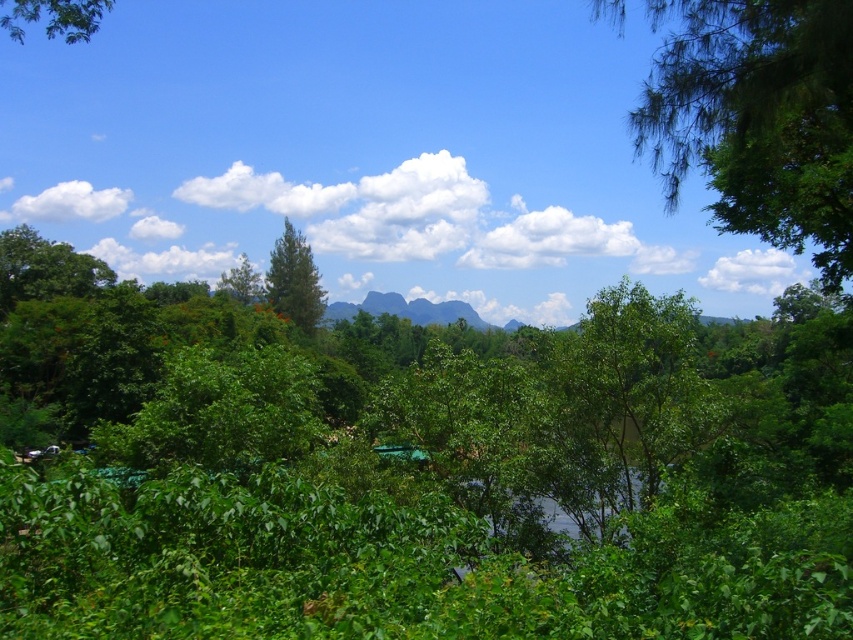
You are a hiker planning to walk from the green leafy tree at upper left to the green rock formation at center. Given that your average walking pace is 1.5 meters per second, how many seconds will it take you to reach the rock formation?

The distance between the green leafy tree at upper left and the green rock formation at center is 103.28 meters. At a pace of 1.5 meters per second, it would take approximately 68.85 seconds to reach the rock formation.

You are an environmental scientist analyzing the spatial distribution of vegetation in the image. Given that the coordinate system starts at the bottom left corner of the image with x increasing to the right and y increasing upwards, can you confirm if the green leafy tree at upper left is located in the top 10 percent of the image vertically?

The green leafy tree at upper left is located at point y coordinate 0.064. Since the coordinate system starts at the bottom left with y increasing upwards, the top 10 percent would be y values between 0.9 and 1.0. The tree is at 0.064, which is much lower than 0.9, so it is not in the top 10 percent vertically.

You are an explorer navigating through this lush landscape. You need to locate the green rock formation at center. Which direction should you move from the green leafy tree at upper left to find it?

The green leafy tree at upper left is to the left of the green rock formation at center, so you should move to the right from the green leafy tree at upper left to reach the green rock formation at center.